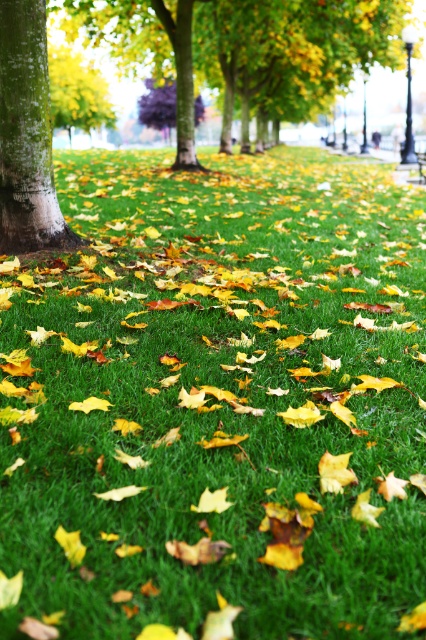
Question: Can you confirm if green rough bark tree at center is wider than smooth white tree trunk at left?

Choices:
 (A) no
 (B) yes

Answer: (B)

Question: Which point is farther to the camera?

Choices:
 (A) purple smooth tree at center
 (B) green rough bark tree at center

Answer: (A)

Question: Which object appears closest to the camera in this image?

Choices:
 (A) smooth white tree trunk at left
 (B) green rough bark tree at center
 (C) purple smooth tree at center

Answer: (B)

Question: Is green rough bark tree at center positioned behind purple smooth tree at center?

Choices:
 (A) no
 (B) yes

Answer: (A)

Question: Is smooth white tree trunk at left bigger than purple smooth tree at center?

Choices:
 (A) no
 (B) yes

Answer: (A)

Question: Among these points, which one is nearest to the camera?

Choices:
 (A) (163, 106)
 (B) (23, 54)

Answer: (B)